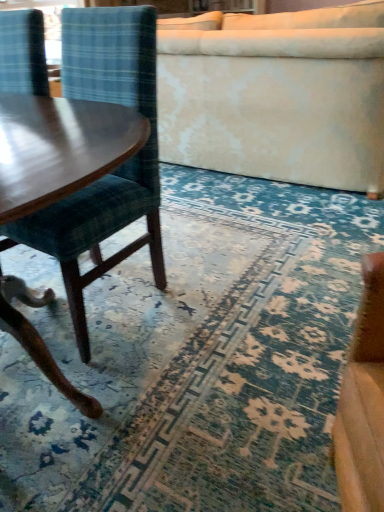
You are a GUI agent. You are given a task and a screenshot of the screen. Output one action in this format:
    pyautogui.click(x=<x>, y=<y>)
    Task: Click on the empty space that is ontop of blue textured rug at center
    
    Given the screenshot: What is the action you would take?
    pyautogui.click(x=216, y=278)